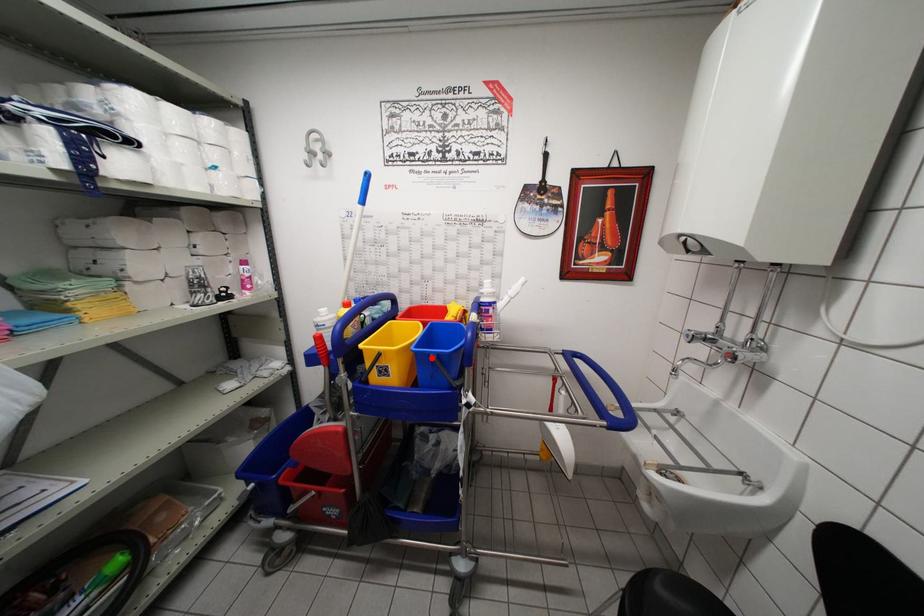
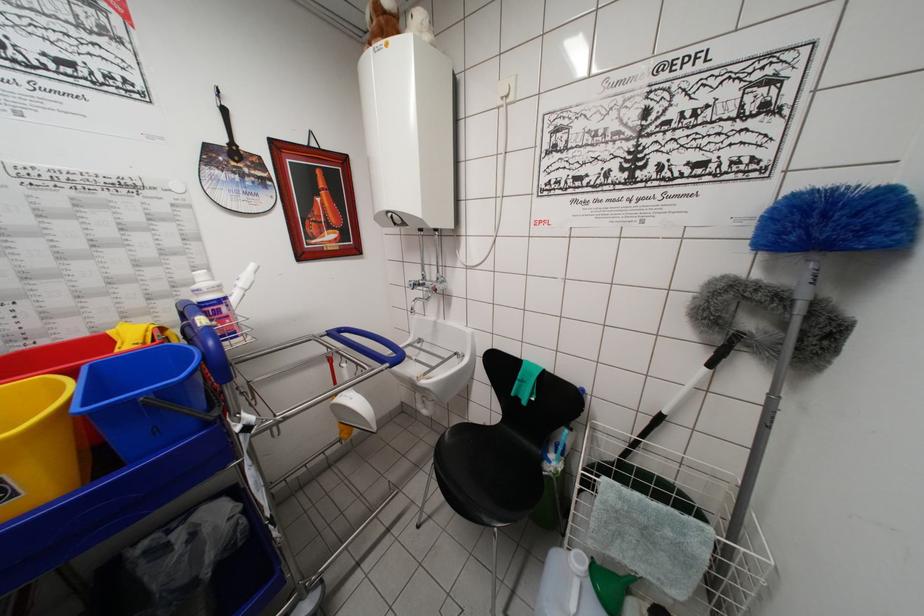
Where in the second image is the point corresponding to the highlighted location from the first image?

(136, 405)